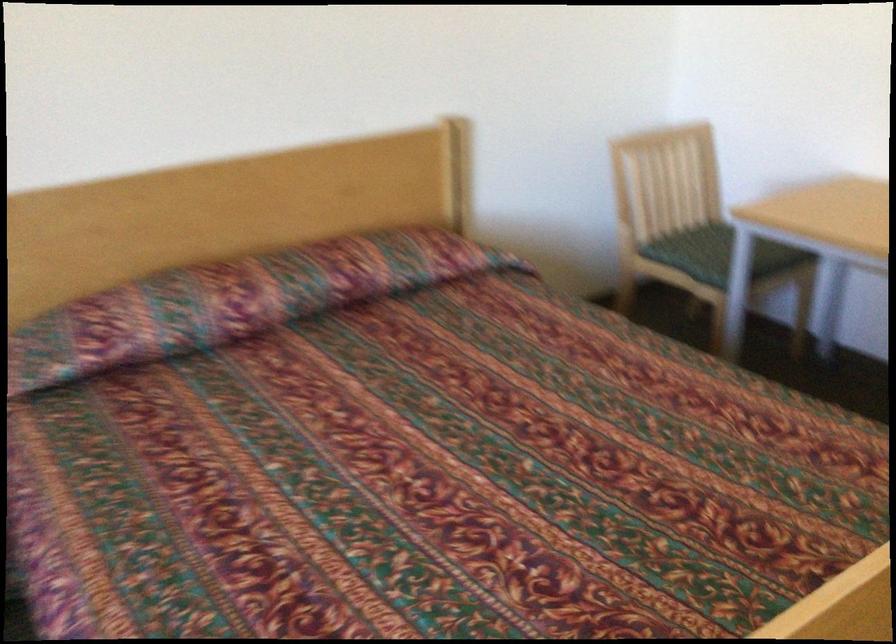
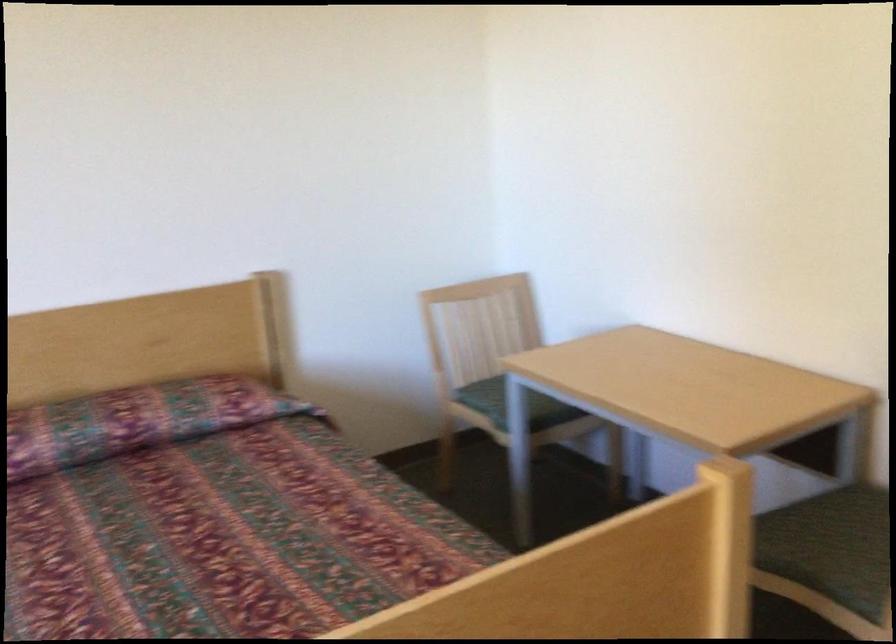
Question: Based on the continuous images, in which direction is the camera rotating? Reply with the corresponding letter.

Choices:
 (A) Left
 (B) Right
 (C) Up
 (D) Down

Answer: (C)